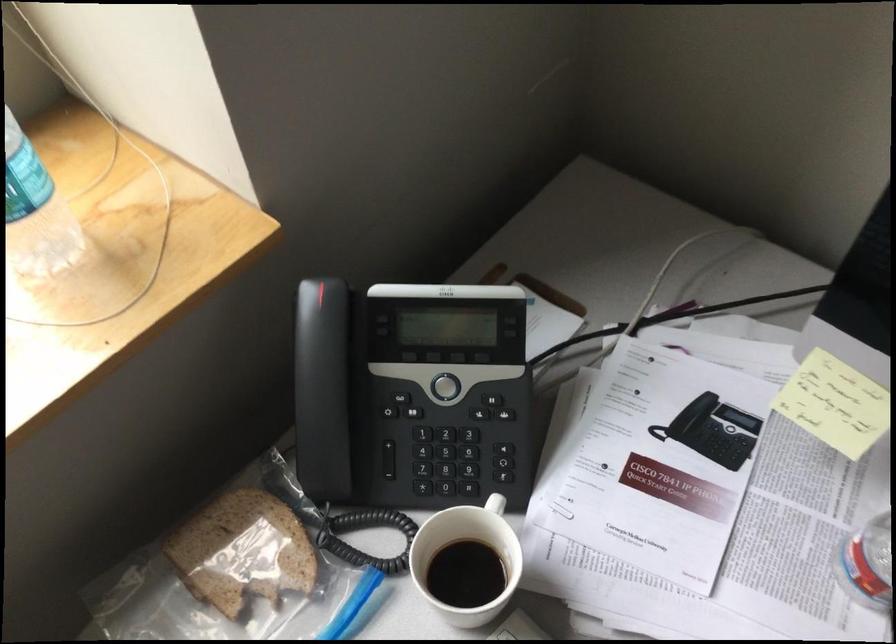
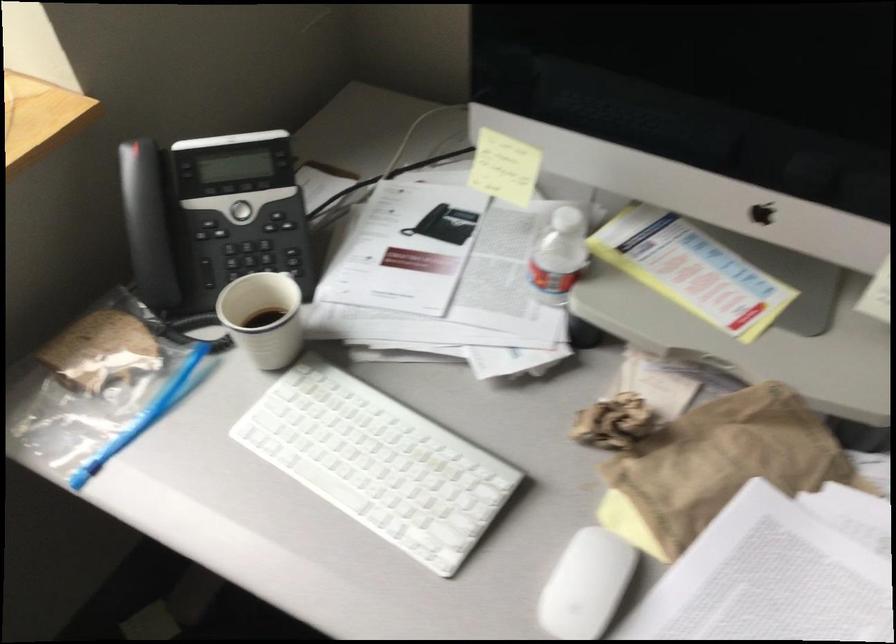
The images are taken continuously from a first-person perspective. In which direction are you moving?

The cameraman moved toward right, backward.